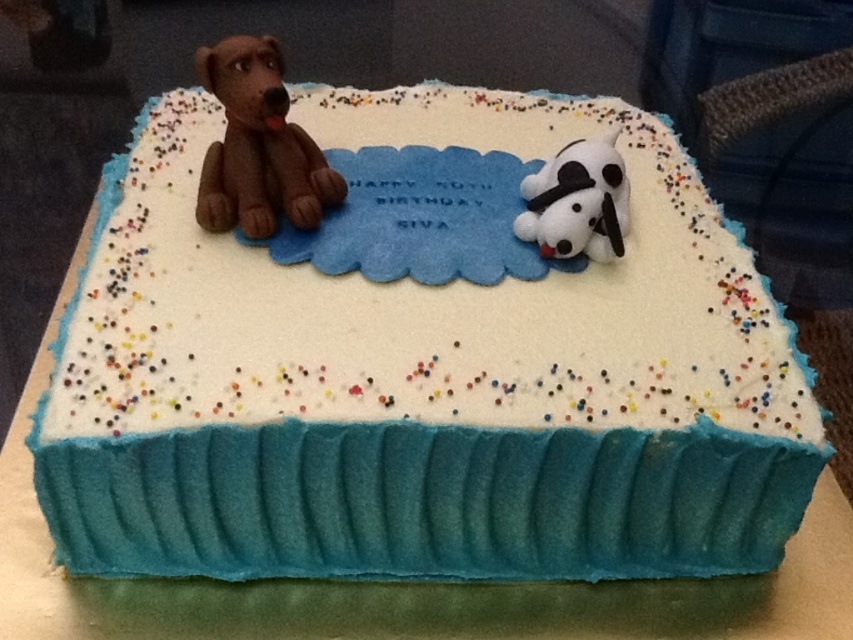
You are planning to place a birthday card on the cake between the matte chocolate teddy bear at left and the white plush dog at upper right. Based on their positions and sizes, where should you place the card to ensure it fits without overlapping either decoration?

The matte chocolate teddy bear at left might be wider than the white plush dog at upper right, so placing the card between them towards the center of the cake would avoid overlapping either decoration.

You are planning to place a candle in the center of the cake. Considering the positions of the matte chocolate teddy bear at left and the white plush dog at upper right, which of these two decorations is closer to the center of the cake?

The matte chocolate teddy bear at left is positioned over the white plush dog at upper right, meaning it is closer to the center of the cake.